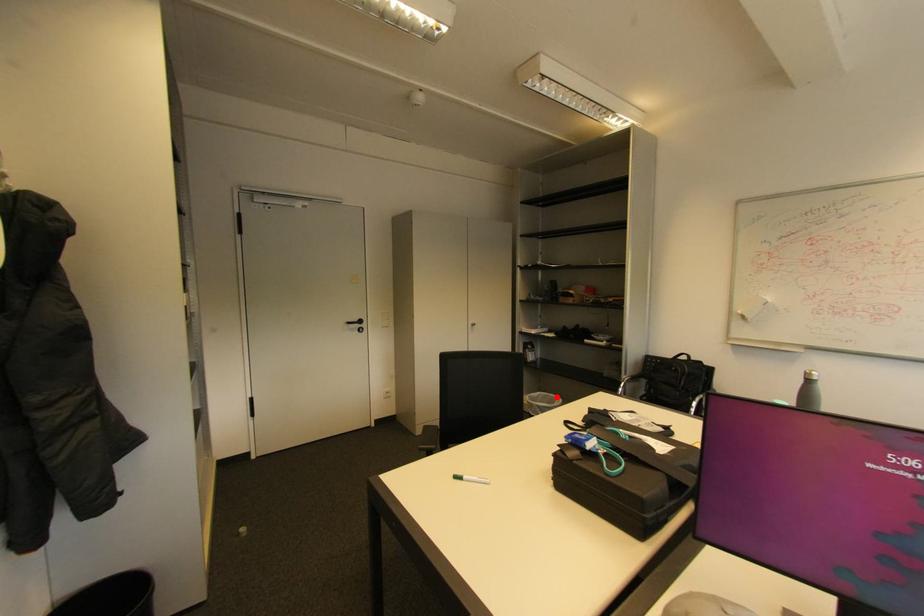
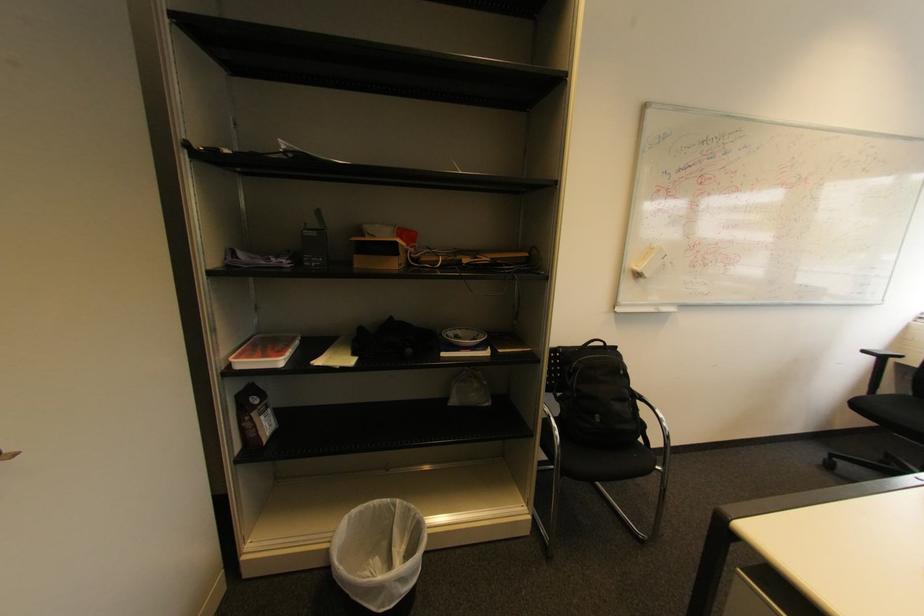
In the second image, find the point that corresponds to the highlighted location in the first image.

(380, 507)